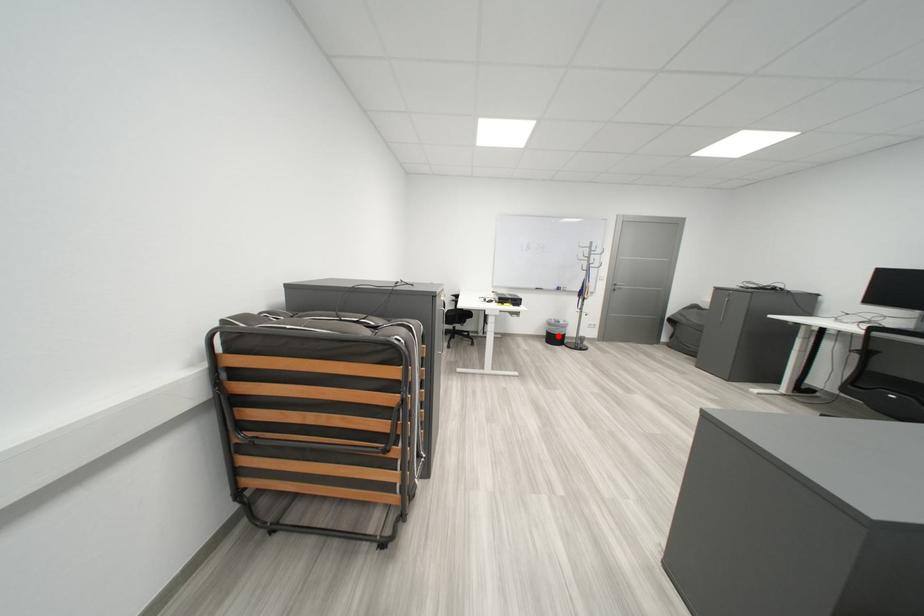
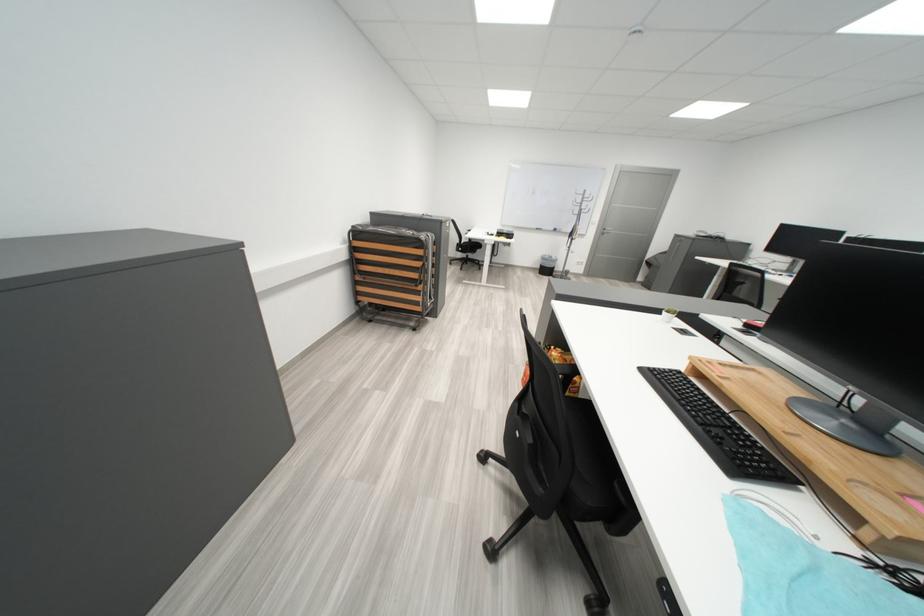
Question: I am providing you with two images of the same scene from different viewpoints. A red point is marked on the first image. At the location where the point appears in image 1, is it still visible in image 2?

Choices:
 (A) Yes
 (B) No

Answer: (A)